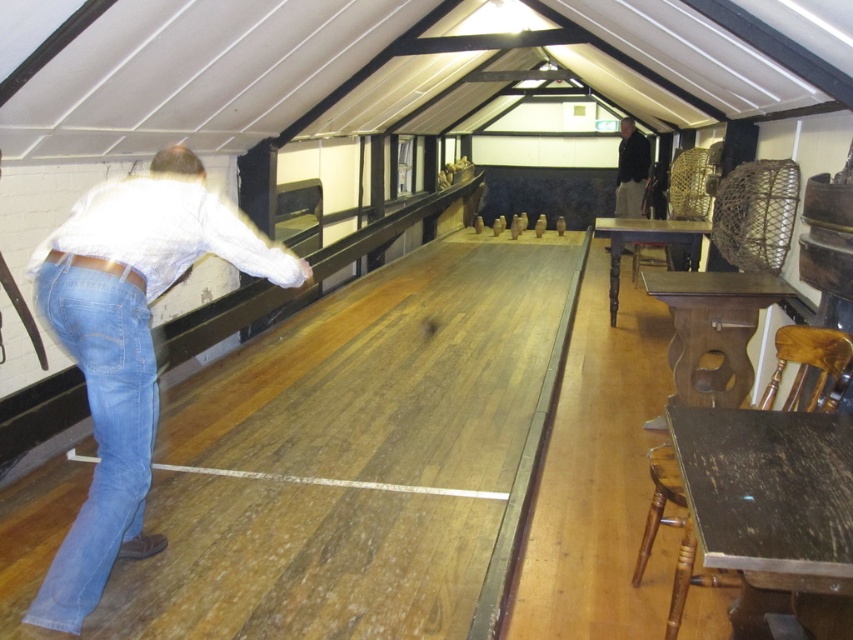
You are designing a new game that requires players to stand on a platform between the blue denim jeans at left and the blue denim jeans at lower left. Which pair of jeans should you choose as the reference for the platform width?

The platform should be designed based on the blue denim jeans at left because its width is larger than the blue denim jeans at lower left, ensuring it accommodates both sizes.

You are designing a new outfit and need to choose between the blue denim jeans at left and the black fabric at right based on their widths. Which one is wider?

The blue denim jeans at left is wider than the black fabric at right.

You are standing in the middle of the room and see the blue denim jeans at left and the black fabric at right. Which object is taller?

The blue denim jeans at left is taller than the black fabric at right.